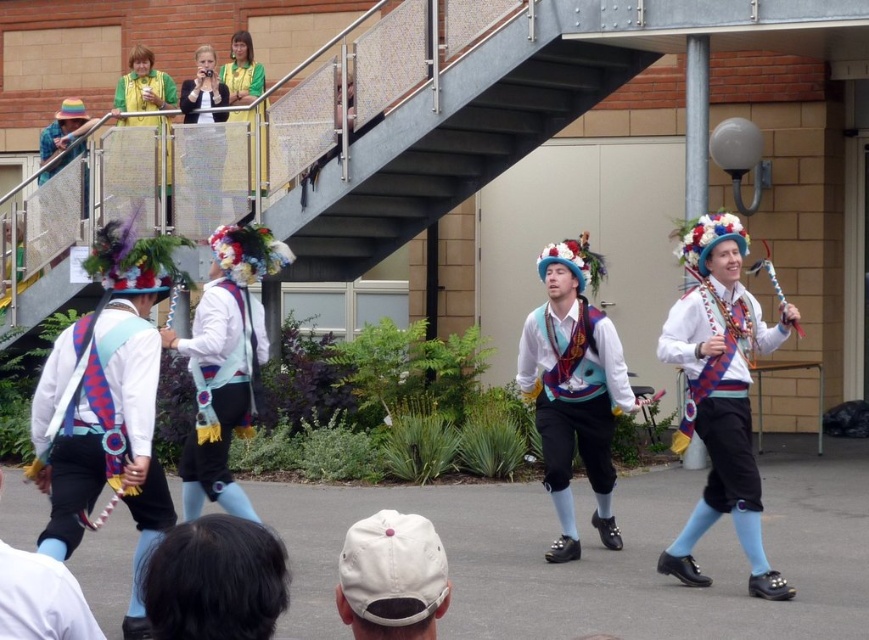
You are a photographer trying to capture the performers in the scene. You notice the white fabric cap at lower center and the blue velvet pants at lower left. Which object would require you to zoom in more to get a clear shot?

The white fabric cap at lower center is smaller than the blue velvet pants at lower left, so you would need to zoom in more to capture the white fabric cap at lower center clearly.

In the scene of the cultural dance performance, where exactly is the matte blue vest at center located?

The matte blue vest at center is located at point coordinates of (574, 387).

You are a photographer trying to capture the performers in the scene. You notice the matte white shirt at upper center and the matte yellow vest at upper left. Which of these two items would appear bigger in your photo?

The matte white shirt at upper center appears bigger in the photo because it is larger in size than the matte yellow vest at upper left.